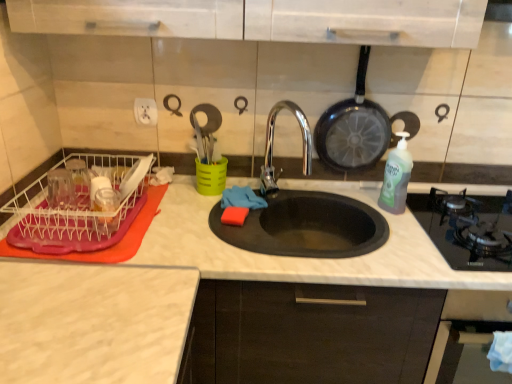
Question: Can black glass gas stove at right be found inside black glass oven at lower right?

Choices:
 (A) no
 (B) yes

Answer: (A)

Question: Can you confirm if black glass oven at lower right is shorter than black glass gas stove at right?

Choices:
 (A) yes
 (B) no

Answer: (B)

Question: Does black glass oven at lower right have a lesser width compared to black glass gas stove at right?

Choices:
 (A) yes
 (B) no

Answer: (A)

Question: Does black glass oven at lower right touch black glass gas stove at right?

Choices:
 (A) yes
 (B) no

Answer: (B)

Question: From the image's perspective, is black glass oven at lower right located beneath black glass gas stove at right?

Choices:
 (A) no
 (B) yes

Answer: (B)

Question: In terms of size, does black non-stick frying pan at upper right appear bigger or smaller than white marble countertop at center?

Choices:
 (A) big
 (B) small

Answer: (B)

Question: Is black non-stick frying pan at upper right inside the boundaries of white marble countertop at center, or outside?

Choices:
 (A) outside
 (B) inside

Answer: (A)

Question: Would you say black non-stick frying pan at upper right is to the left or to the right of white marble countertop at center in the picture?

Choices:
 (A) left
 (B) right

Answer: (A)

Question: From the image's perspective, is black non-stick frying pan at upper right located above or below white marble countertop at center?

Choices:
 (A) above
 (B) below

Answer: (A)

Question: In terms of height, does black non-stick frying pan at upper right look taller or shorter compared to black glass gas stove at right?

Choices:
 (A) short
 (B) tall

Answer: (B)

Question: Is black non-stick frying pan at upper right in front of or behind black glass gas stove at right in the image?

Choices:
 (A) front
 (B) behind

Answer: (B)

Question: Choose the correct answer: Is black non-stick frying pan at upper right inside black glass gas stove at right or outside it?

Choices:
 (A) outside
 (B) inside

Answer: (A)

Question: Based on their positions, is black non-stick frying pan at upper right located to the left or right of black glass gas stove at right?

Choices:
 (A) right
 (B) left

Answer: (B)

Question: Does point (384, 135) appear closer or farther from the camera than point (31, 236)?

Choices:
 (A) farther
 (B) closer

Answer: (A)

Question: Is black non-stick frying pan at upper right wider or thinner than transparent plastic dish rack at left?

Choices:
 (A) thin
 (B) wide

Answer: (A)